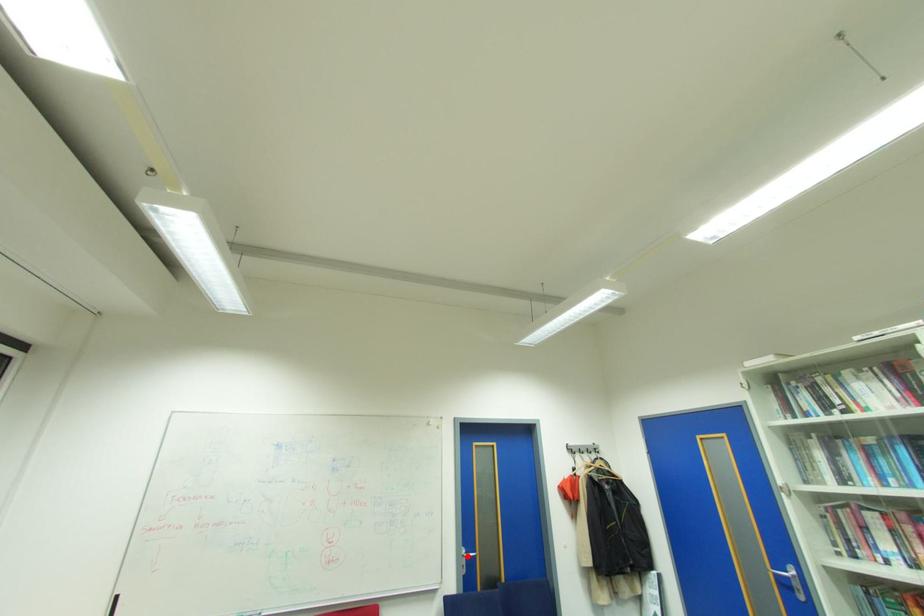
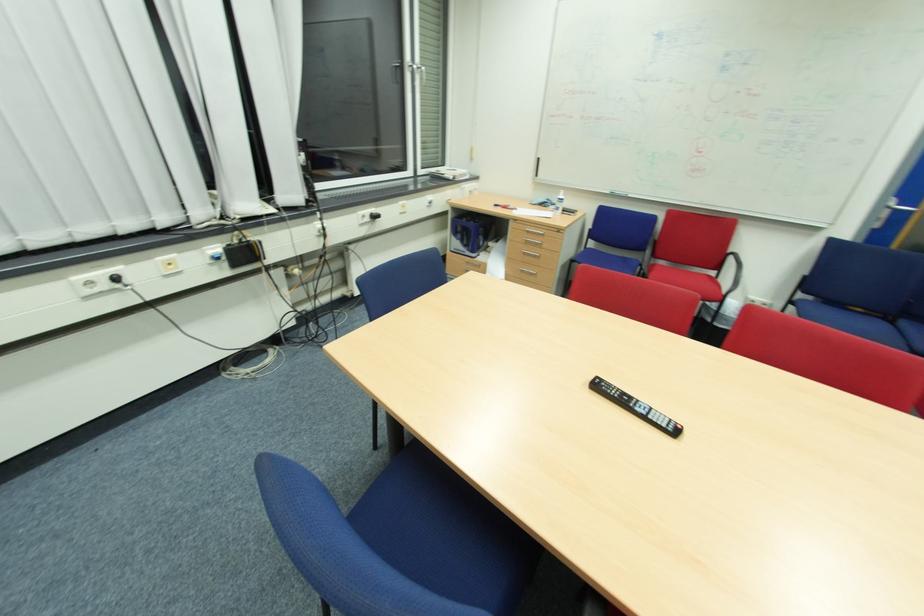
Question: I am providing you with two images of the same scene from different viewpoints. A red point is shown in image1. For the corresponding object point in image2, is it positioned nearer or farther from the camera?

Choices:
 (A) Nearer
 (B) Farther

Answer: (A)